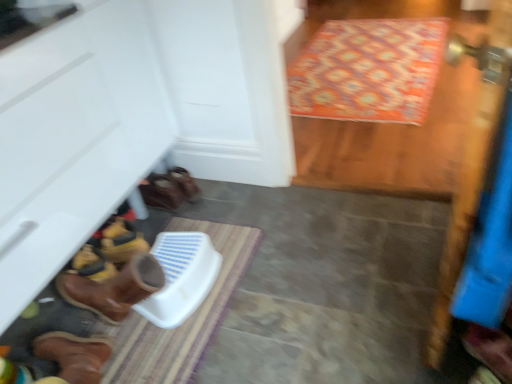
Image resolution: width=512 pixels, height=384 pixels. I want to click on brown leather boot at lower left, which is the first footwear in bottom-to-top order, so click(x=490, y=349).

The height and width of the screenshot is (384, 512). I want to click on patterned fabric doormat at upper right, which ranks as the 2th doormat in front-to-back order, so click(368, 70).

Describe the element at coordinates (169, 189) in the screenshot. This screenshot has height=384, width=512. I see `brown leather boot at lower left, the 2th footwear viewed from the right` at that location.

Where is `striped fabric doormat at lower center, the first doormat when ordered from bottom to top`? Image resolution: width=512 pixels, height=384 pixels. striped fabric doormat at lower center, the first doormat when ordered from bottom to top is located at coordinates (186, 320).

Is brown leather boot at lower left, which is the 1th footwear in top-to-bottom order, to the left of brown leather boot at lower left, the 2th footwear in the top-to-bottom sequence, from the viewer's perspective?

Yes.

Image resolution: width=512 pixels, height=384 pixels. I want to click on footwear above the brown leather boot at lower left, the 2th footwear in the top-to-bottom sequence (from a real-world perspective), so click(x=169, y=189).

Based on the photo, looking at the image, does brown leather boot at lower left, positioned as the 1th footwear in left-to-right order, seem bigger or smaller compared to brown leather boot at lower left, acting as the first footwear starting from the right?

Considering their sizes, brown leather boot at lower left, positioned as the 1th footwear in left-to-right order, takes up more space than brown leather boot at lower left, acting as the first footwear starting from the right.

How many degrees apart are the facing directions of brown leather boot at lower left, which is counted as the 2th footwear, starting from the bottom, and striped fabric doormat at lower center, placed as the first doormat when sorted from front to back?

There is a 166-degree angle between the facing directions of brown leather boot at lower left, which is counted as the 2th footwear, starting from the bottom, and striped fabric doormat at lower center, placed as the first doormat when sorted from front to back.

Who is bigger, brown leather boot at lower left, marked as the second footwear in a front-to-back arrangement, or striped fabric doormat at lower center, arranged as the 2th doormat when viewed from the top?

striped fabric doormat at lower center, arranged as the 2th doormat when viewed from the top, is bigger.

Considering the sizes of objects brown leather boot at lower left, the 2th footwear viewed from the right, and striped fabric doormat at lower center, arranged as the 2th doormat when viewed from the top, in the image provided, who is taller, brown leather boot at lower left, the 2th footwear viewed from the right, or striped fabric doormat at lower center, arranged as the 2th doormat when viewed from the top,?

Standing taller between the two is brown leather boot at lower left, the 2th footwear viewed from the right.

Looking at this image, from the image's perspective, is brown leather boot at lower left, which is the 1th footwear in top-to-bottom order, on top of striped fabric doormat at lower center, which appears as the first doormat when viewed from the left?

Yes, from the image's perspective, brown leather boot at lower left, which is the 1th footwear in top-to-bottom order, is on top of striped fabric doormat at lower center, which appears as the first doormat when viewed from the left.

From a real-world perspective, does patterned fabric doormat at upper right, which ranks as the 2th doormat in front-to-back order, sit lower than brown leather boot at lower left, the 1th footwear positioned from the back?

Yes.

Consider the image. Is patterned fabric doormat at upper right, acting as the second doormat starting from the left, bigger than brown leather boot at lower left, which is the 1th footwear in top-to-bottom order?

Yes, patterned fabric doormat at upper right, acting as the second doormat starting from the left, is bigger than brown leather boot at lower left, which is the 1th footwear in top-to-bottom order.

Which object is closer to the camera taking this photo, patterned fabric doormat at upper right, acting as the 1th doormat starting from the right, or brown leather boot at lower left, which is the 1th footwear in top-to-bottom order?

brown leather boot at lower left, which is the 1th footwear in top-to-bottom order.

Can you confirm if patterned fabric doormat at upper right, placed as the second doormat when sorted from bottom to top, is shorter than brown leather boot at lower left, which is the 1th footwear in top-to-bottom order?

Yes.

Is patterned fabric doormat at upper right, acting as the second doormat starting from the left, looking in the opposite direction of striped fabric doormat at lower center, placed as the first doormat when sorted from front to back?

patterned fabric doormat at upper right, acting as the second doormat starting from the left, does not have its back to striped fabric doormat at lower center, placed as the first doormat when sorted from front to back.

Is patterned fabric doormat at upper right, arranged as the first doormat when viewed from the top, far from striped fabric doormat at lower center, which appears as the first doormat when viewed from the left?

Absolutely, patterned fabric doormat at upper right, arranged as the first doormat when viewed from the top, is distant from striped fabric doormat at lower center, which appears as the first doormat when viewed from the left.

Does point (356, 51) appear closer or farther from the camera than point (246, 236)?

Point (356, 51) appears to be farther away from the viewer than point (246, 236).

How different are the orientations of patterned fabric doormat at upper right, acting as the second doormat starting from the left, and striped fabric doormat at lower center, arranged as the 2th doormat when viewed from the top, in degrees?

92.9 degrees separate the facing orientations of patterned fabric doormat at upper right, acting as the second doormat starting from the left, and striped fabric doormat at lower center, arranged as the 2th doormat when viewed from the top.

Consider the image. Does striped fabric doormat at lower center, which appears as the first doormat when viewed from the left, lie behind patterned fabric doormat at upper right, which ranks as the 2th doormat in front-to-back order?

No, it is in front of patterned fabric doormat at upper right, which ranks as the 2th doormat in front-to-back order.

Could you tell me if striped fabric doormat at lower center, the second doormat from the back, is turned towards patterned fabric doormat at upper right, which is the 1th doormat in back-to-front order?

No, striped fabric doormat at lower center, the second doormat from the back, is not turned towards patterned fabric doormat at upper right, which is the 1th doormat in back-to-front order.

This screenshot has width=512, height=384. Identify the location of doormat behind the striped fabric doormat at lower center, which ranks as the second doormat in right-to-left order. (368, 70).

Is brown leather boot at lower left, acting as the first footwear starting from the right, thinner than brown leather boot at lower left, positioned as the 1th footwear in left-to-right order?

Yes, brown leather boot at lower left, acting as the first footwear starting from the right, is thinner than brown leather boot at lower left, positioned as the 1th footwear in left-to-right order.

At what (x,y) coordinates should I click in order to perform the action: click on footwear above the brown leather boot at lower left, the 2th footwear in the top-to-bottom sequence (from the image's perspective). Please return your answer as a coordinate pair (x, y). This screenshot has width=512, height=384. Looking at the image, I should click on (169, 189).

Which of these two, brown leather boot at lower left, which is the first footwear from front to back, or brown leather boot at lower left, the 1th footwear positioned from the back, is bigger?

brown leather boot at lower left, the 1th footwear positioned from the back, is bigger.

Which object is wider, striped fabric doormat at lower center, the second doormat from the back, or brown leather boot at lower left, which is the 1th footwear in top-to-bottom order?

striped fabric doormat at lower center, the second doormat from the back, is wider.

Consider the image. Measure the distance between striped fabric doormat at lower center, which appears as the first doormat when viewed from the left, and brown leather boot at lower left, the 2th footwear viewed from the right.

striped fabric doormat at lower center, which appears as the first doormat when viewed from the left, is 19.96 inches away from brown leather boot at lower left, the 2th footwear viewed from the right.

How different are the orientations of striped fabric doormat at lower center, arranged as the 2th doormat when viewed from the top, and brown leather boot at lower left, positioned as the 1th footwear in left-to-right order, in degrees?

The angular difference between striped fabric doormat at lower center, arranged as the 2th doormat when viewed from the top, and brown leather boot at lower left, positioned as the 1th footwear in left-to-right order, is 166 degrees.

In the scene shown: Is striped fabric doormat at lower center, which ranks as the second doormat in right-to-left order, closer to the viewer compared to brown leather boot at lower left, positioned as the 1th footwear in left-to-right order?

That is True.

Where is `footwear below the brown leather boot at lower left, the 1th footwear positioned from the back (from the image's perspective)`? The width and height of the screenshot is (512, 384). footwear below the brown leather boot at lower left, the 1th footwear positioned from the back (from the image's perspective) is located at coordinates (490, 349).

Identify the location of doormat lying in front of the brown leather boot at lower left, which is counted as the 2th footwear, starting from the bottom. This screenshot has width=512, height=384. (186, 320).

Which object lies further to the anchor point patterned fabric doormat at upper right, acting as the 1th doormat starting from the right, striped fabric doormat at lower center, the first doormat when ordered from bottom to top, or brown leather boot at lower left, which is the first footwear in bottom-to-top order?

brown leather boot at lower left, which is the first footwear in bottom-to-top order, lies further to patterned fabric doormat at upper right, acting as the 1th doormat starting from the right, than the other object.

Looking at the image, which one is located closer to brown leather boot at lower left, which is the first footwear in bottom-to-top order, brown leather boot at lower left, the 1th footwear positioned from the back, or patterned fabric doormat at upper right, acting as the second doormat starting from the left?

Among the two, brown leather boot at lower left, the 1th footwear positioned from the back, is located nearer to brown leather boot at lower left, which is the first footwear in bottom-to-top order.

Which object lies further to the anchor point brown leather boot at lower left, which is the 1th footwear in top-to-bottom order, brown leather boot at lower left, which is the first footwear in bottom-to-top order, or striped fabric doormat at lower center, placed as the first doormat when sorted from front to back?

brown leather boot at lower left, which is the first footwear in bottom-to-top order, lies further to brown leather boot at lower left, which is the 1th footwear in top-to-bottom order, than the other object.

Looking at the image, which one is located further to brown leather boot at lower left, the 2th footwear in the top-to-bottom sequence, patterned fabric doormat at upper right, which is the 1th doormat in back-to-front order, or striped fabric doormat at lower center, the second doormat from the back?

patterned fabric doormat at upper right, which is the 1th doormat in back-to-front order, lies further to brown leather boot at lower left, the 2th footwear in the top-to-bottom sequence, than the other object.

Considering their positions, is brown leather boot at lower left, the 2th footwear in the top-to-bottom sequence, positioned further to striped fabric doormat at lower center, arranged as the 2th doormat when viewed from the top, than brown leather boot at lower left, which is counted as the 2th footwear, starting from the bottom?

Based on the image, brown leather boot at lower left, the 2th footwear in the top-to-bottom sequence, appears to be further to striped fabric doormat at lower center, arranged as the 2th doormat when viewed from the top.

Based on their spatial positions, is brown leather boot at lower left, acting as the first footwear starting from the right, or patterned fabric doormat at upper right, acting as the 1th doormat starting from the right, further from striped fabric doormat at lower center, arranged as the 2th doormat when viewed from the top?

patterned fabric doormat at upper right, acting as the 1th doormat starting from the right, is positioned further to the anchor striped fabric doormat at lower center, arranged as the 2th doormat when viewed from the top.

Which object lies nearer to the anchor point patterned fabric doormat at upper right, acting as the 1th doormat starting from the right, striped fabric doormat at lower center, placed as the first doormat when sorted from front to back, or brown leather boot at lower left, which is the 1th footwear in top-to-bottom order?

brown leather boot at lower left, which is the 1th footwear in top-to-bottom order.

Which object lies nearer to the anchor point striped fabric doormat at lower center, arranged as the 2th doormat when viewed from the top, patterned fabric doormat at upper right, arranged as the first doormat when viewed from the top, or brown leather boot at lower left, which is the 1th footwear in top-to-bottom order?

brown leather boot at lower left, which is the 1th footwear in top-to-bottom order.

This screenshot has height=384, width=512. What are the coordinates of `footwear between patterned fabric doormat at upper right, placed as the second doormat when sorted from bottom to top, and striped fabric doormat at lower center, which ranks as the second doormat in right-to-left order, from top to bottom` in the screenshot? It's located at (169, 189).

I want to click on doormat that lies between patterned fabric doormat at upper right, acting as the 1th doormat starting from the right, and brown leather boot at lower left, which is the first footwear in bottom-to-top order, from top to bottom, so click(x=186, y=320).

Image resolution: width=512 pixels, height=384 pixels. I want to click on doormat situated between brown leather boot at lower left, positioned as the 1th footwear in left-to-right order, and brown leather boot at lower left, which is the first footwear from front to back, from left to right, so click(186, 320).

You are a GUI agent. You are given a task and a screenshot of the screen. Output one action in this format:
    pyautogui.click(x=<x>, y=<y>)
    Task: Click on the footwear between patterned fabric doormat at upper right, acting as the second doormat starting from the left, and brown leather boot at lower left, which is the first footwear from front to back, from top to bottom
    
    Given the screenshot: What is the action you would take?
    pyautogui.click(x=169, y=189)